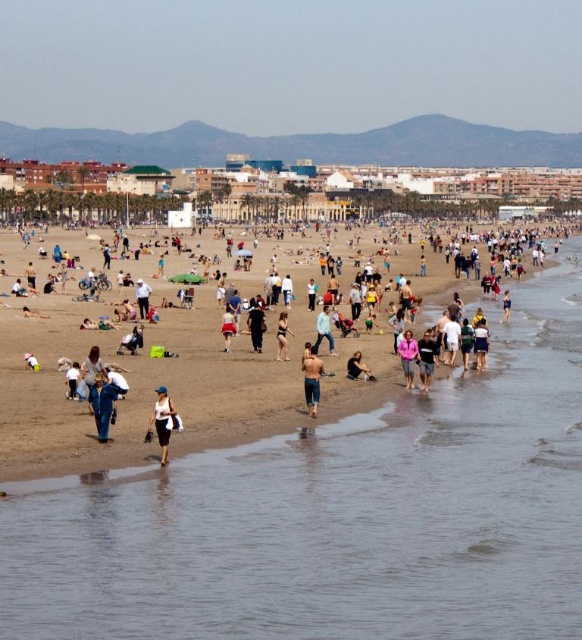
Does pink fabric at lower center come in front of black matte pants at center?

Yes, it is in front of black matte pants at center.

At what (x,y) coordinates should I click in order to perform the action: click on pink fabric at lower center. Please return your answer as a coordinate pair (x, y). The width and height of the screenshot is (582, 640). Looking at the image, I should click on (427, 356).

At what (x,y) coordinates should I click in order to perform the action: click on pink fabric at lower center. Please return your answer as a coordinate pair (x, y). Looking at the image, I should click on (427, 356).

Is blue denim jeans at lower left smaller than denim shorts at center?

Correct, blue denim jeans at lower left occupies less space than denim shorts at center.

Where is `blue denim jeans at lower left`? The height and width of the screenshot is (640, 582). blue denim jeans at lower left is located at coordinates (102, 404).

Who is more distant from viewer, (98,435) or (306,381)?

The point (306,381) is more distant.

I want to click on blue denim jeans at lower left, so click(102, 404).

Who is more distant from viewer, (430, 381) or (407, 346)?

Positioned behind is point (430, 381).

Is point (420, 342) in front of point (411, 372)?

No, it is not.

Find the location of a particular element. This screenshot has height=640, width=582. pink fabric at lower center is located at coordinates (427, 356).